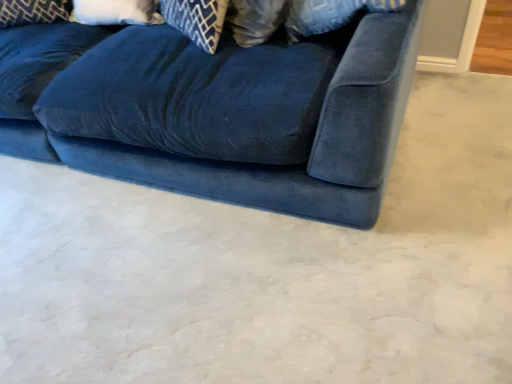
This screenshot has width=512, height=384. What do you see at coordinates (280, 167) in the screenshot?
I see `velvet blue couch at center` at bounding box center [280, 167].

Where is `white soft pillow at upper left, the first pillow when ordered from right to left`? white soft pillow at upper left, the first pillow when ordered from right to left is located at coordinates (117, 12).

Which is more to the left, velvet blue couch at center or velvet blue pillow at upper left, arranged as the first pillow when viewed from the left?

From the viewer's perspective, velvet blue pillow at upper left, arranged as the first pillow when viewed from the left, appears more on the left side.

Can you confirm if velvet blue couch at center is bigger than velvet blue pillow at upper left, which is the second pillow from right to left?

Correct, velvet blue couch at center is larger in size than velvet blue pillow at upper left, which is the second pillow from right to left.

Locate an element on the screen. studio couch below the velvet blue pillow at upper left, arranged as the first pillow when viewed from the left (from the image's perspective) is located at coordinates point(280,167).

Where is `studio couch on the left side of white soft pillow at upper left, acting as the 2th pillow starting from the left`? studio couch on the left side of white soft pillow at upper left, acting as the 2th pillow starting from the left is located at coordinates (280, 167).

How different are the orientations of white soft pillow at upper left, acting as the 2th pillow starting from the left, and velvet blue couch at center in degrees?

The facing directions of white soft pillow at upper left, acting as the 2th pillow starting from the left, and velvet blue couch at center are 0.734 degrees apart.

Is white soft pillow at upper left, acting as the 2th pillow starting from the left, at the right side of velvet blue couch at center?

Yes, white soft pillow at upper left, acting as the 2th pillow starting from the left, is to the right of velvet blue couch at center.

How far apart are white soft pillow at upper left, acting as the 2th pillow starting from the left, and velvet blue couch at center?

white soft pillow at upper left, acting as the 2th pillow starting from the left, is 31.39 inches away from velvet blue couch at center.

Is velvet blue pillow at upper left, arranged as the first pillow when viewed from the left, not close to velvet blue couch at center?

No, velvet blue pillow at upper left, arranged as the first pillow when viewed from the left, is not far from velvet blue couch at center.

Is velvet blue couch at center at the back of velvet blue pillow at upper left, which is the second pillow from right to left?

That's right, velvet blue pillow at upper left, which is the second pillow from right to left, is facing away from velvet blue couch at center.

Which is in front, point (66, 20) or point (388, 49)?

Positioned in front is point (388, 49).

Which object is wider, velvet blue pillow at upper left, arranged as the first pillow when viewed from the left, or velvet blue couch at center?

velvet blue couch at center is wider.

From the image's perspective, is velvet blue couch at center below white soft pillow at upper left, acting as the 2th pillow starting from the left?

Correct, velvet blue couch at center appears lower than white soft pillow at upper left, acting as the 2th pillow starting from the left, in the image.

Visually, is velvet blue couch at center positioned to the left or to the right of white soft pillow at upper left, the first pillow when ordered from right to left?

Clearly, velvet blue couch at center is on the left of white soft pillow at upper left, the first pillow when ordered from right to left, in the image.

Locate an element on the screen. studio couch below the white soft pillow at upper left, the first pillow when ordered from right to left (from the image's perspective) is located at coordinates click(280, 167).

Which of these two, velvet blue couch at center or white soft pillow at upper left, acting as the 2th pillow starting from the left, is wider?

velvet blue couch at center.

Does white soft pillow at upper left, acting as the 2th pillow starting from the left, come in front of velvet blue pillow at upper left, arranged as the first pillow when viewed from the left?

Yes, it is in front of velvet blue pillow at upper left, arranged as the first pillow when viewed from the left.

Would you consider white soft pillow at upper left, acting as the 2th pillow starting from the left, to be distant from velvet blue pillow at upper left, which is the second pillow from right to left?

No, there isn't a large distance between white soft pillow at upper left, acting as the 2th pillow starting from the left, and velvet blue pillow at upper left, which is the second pillow from right to left.

Considering their positions, is velvet blue pillow at upper left, which is the second pillow from right to left, located in front of or behind white soft pillow at upper left, acting as the 2th pillow starting from the left?

Clearly, velvet blue pillow at upper left, which is the second pillow from right to left, is behind white soft pillow at upper left, acting as the 2th pillow starting from the left.

From a real-world perspective, is velvet blue pillow at upper left, arranged as the first pillow when viewed from the left, physically above white soft pillow at upper left, the first pillow when ordered from right to left?

Correct, in the physical world, velvet blue pillow at upper left, arranged as the first pillow when viewed from the left, is higher than white soft pillow at upper left, the first pillow when ordered from right to left.

From their relative heights in the image, would you say velvet blue pillow at upper left, arranged as the first pillow when viewed from the left, is taller or shorter than white soft pillow at upper left, the first pillow when ordered from right to left?

Clearly, velvet blue pillow at upper left, arranged as the first pillow when viewed from the left, is taller compared to white soft pillow at upper left, the first pillow when ordered from right to left.

You are a GUI agent. You are given a task and a screenshot of the screen. Output one action in this format:
    pyautogui.click(x=<x>, y=<y>)
    Task: Click on the 2nd pillow above the velvet blue couch at center (from a real-world perspective)
    Image resolution: width=512 pixels, height=384 pixels.
    Given the screenshot: What is the action you would take?
    pyautogui.click(x=33, y=12)

Locate an element on the screen. The width and height of the screenshot is (512, 384). the 1st pillow positioned above the velvet blue couch at center (from the image's perspective) is located at coordinates (117, 12).

When comparing their distances from white soft pillow at upper left, the first pillow when ordered from right to left, does velvet blue couch at center or velvet blue pillow at upper left, which is the second pillow from right to left, seem further?

Among the two, velvet blue couch at center is located further to white soft pillow at upper left, the first pillow when ordered from right to left.

Based on their spatial positions, is velvet blue pillow at upper left, arranged as the first pillow when viewed from the left, or white soft pillow at upper left, acting as the 2th pillow starting from the left, closer to velvet blue couch at center?

white soft pillow at upper left, acting as the 2th pillow starting from the left, lies closer to velvet blue couch at center than the other object.

From the image, which object appears to be farther from velvet blue pillow at upper left, arranged as the first pillow when viewed from the left, velvet blue couch at center or white soft pillow at upper left, acting as the 2th pillow starting from the left?

Among the two, velvet blue couch at center is located further to velvet blue pillow at upper left, arranged as the first pillow when viewed from the left.

From the image, which object appears to be nearer to white soft pillow at upper left, acting as the 2th pillow starting from the left, velvet blue pillow at upper left, which is the second pillow from right to left, or velvet blue couch at center?

velvet blue pillow at upper left, which is the second pillow from right to left.

Considering their positions, is white soft pillow at upper left, the first pillow when ordered from right to left, positioned further to velvet blue couch at center than velvet blue pillow at upper left, arranged as the first pillow when viewed from the left?

velvet blue pillow at upper left, arranged as the first pillow when viewed from the left, is further to velvet blue couch at center.

Considering their positions, is white soft pillow at upper left, acting as the 2th pillow starting from the left, positioned further to velvet blue pillow at upper left, which is the second pillow from right to left, than velvet blue couch at center?

→ Among the two, velvet blue couch at center is located further to velvet blue pillow at upper left, which is the second pillow from right to left.

Identify the location of pillow between velvet blue couch at center and velvet blue pillow at upper left, which is the second pillow from right to left, from front to back. (117, 12).